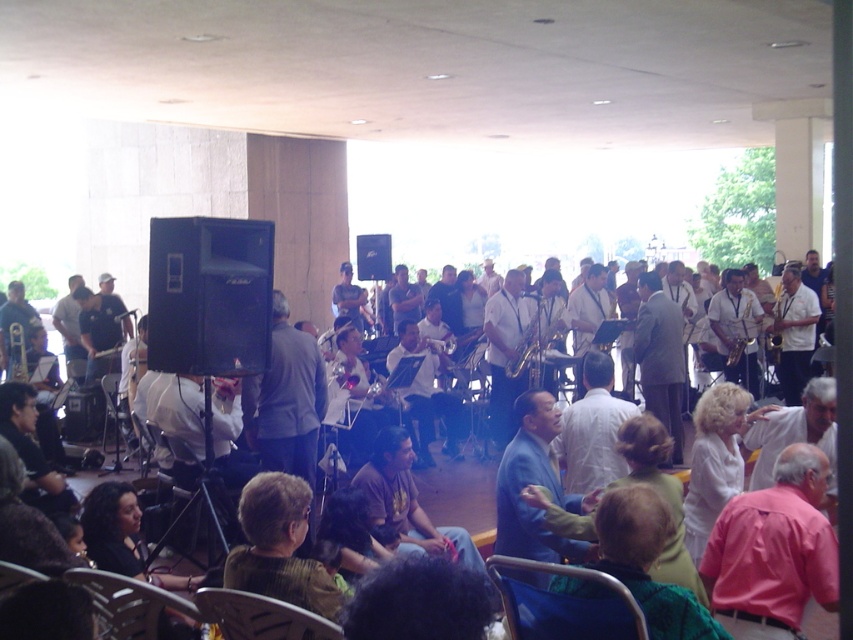
Question: Does pink fabric shirt at lower right appear on the left side of plastic seat at lower left?

Choices:
 (A) no
 (B) yes

Answer: (A)

Question: Considering the real-world distances, which object is closest to the green fabric chair at lower center?

Choices:
 (A) green striped shirt at lower center
 (B) dark brown hair at lower left
 (C) matte gray suit at center
 (D) plastic seat at lower left

Answer: (D)

Question: Which of the following is the closest to the observer?

Choices:
 (A) (136, 582)
 (B) (262, 536)
 (C) (291, 611)
 (D) (453, 412)

Answer: (C)

Question: Does metallic blue chair at lower center have a greater width compared to matte white shirt at center?

Choices:
 (A) no
 (B) yes

Answer: (A)

Question: Can you confirm if pink fabric shirt at lower right is wider than matte gray suit at center?

Choices:
 (A) no
 (B) yes

Answer: (A)

Question: Which of the following is the closest to the observer?

Choices:
 (A) (125, 486)
 (B) (287, 502)
 (C) (434, 404)
 (D) (642, 358)

Answer: (B)